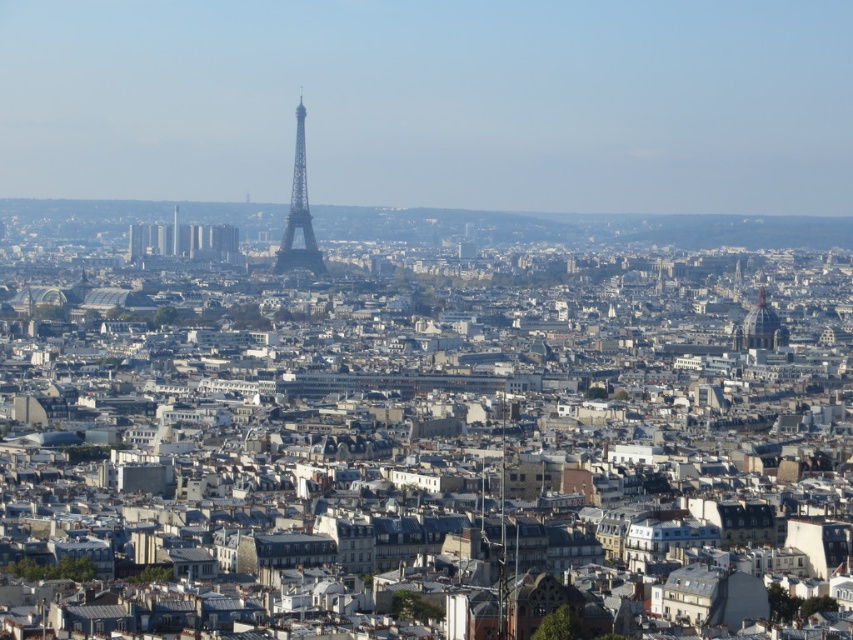
Question: Is metallic silver eiffel tower at center below matte gold dome at center-right?

Choices:
 (A) no
 (B) yes

Answer: (A)

Question: Which point is closer to the camera?

Choices:
 (A) (761, 317)
 (B) (283, 268)

Answer: (A)

Question: Does metallic silver eiffel tower at center have a lesser width compared to matte gold dome at center-right?

Choices:
 (A) yes
 (B) no

Answer: (B)

Question: Is metallic silver eiffel tower at center further to the viewer compared to matte gold dome at center-right?

Choices:
 (A) yes
 (B) no

Answer: (A)